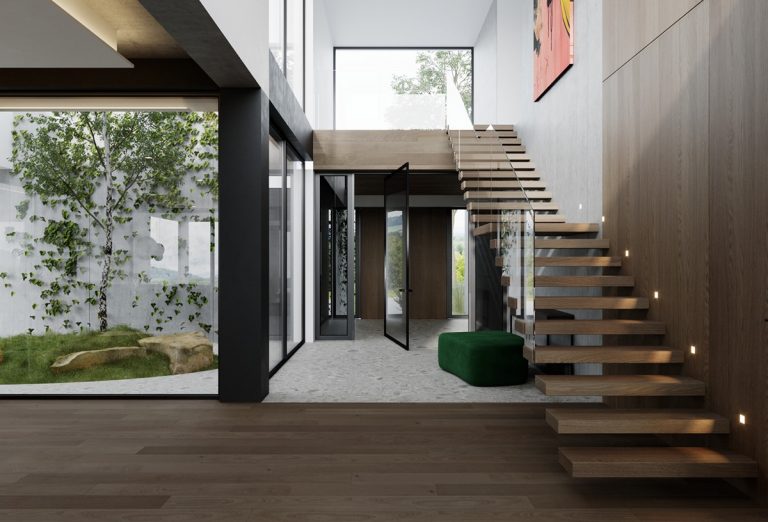
Locate an element on the screen. Image resolution: width=768 pixels, height=522 pixels. window is located at coordinates (419, 93).